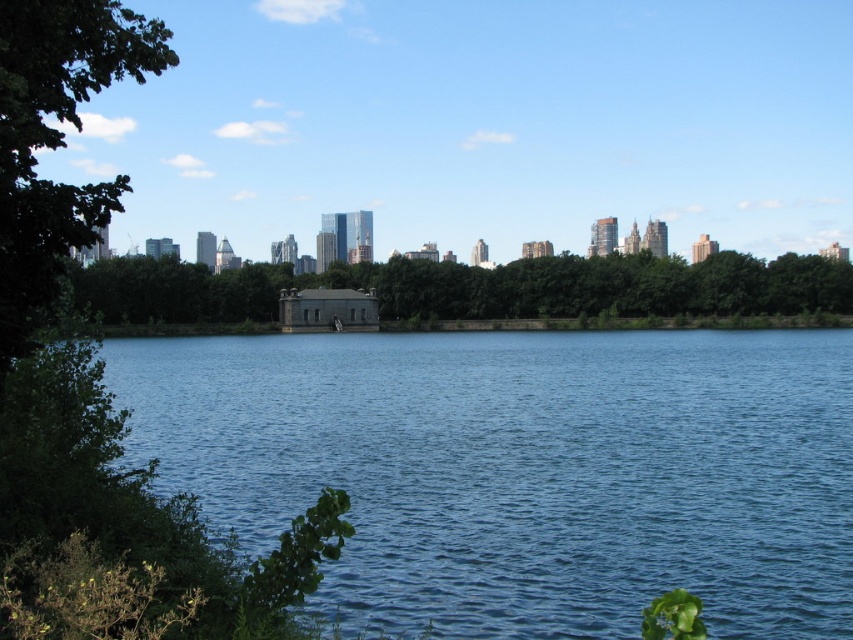
You are planning to take a photo of the blue water at center and the green leafy tree at left. Which object will appear wider in the photo?

The blue water at center will appear wider in the photo because its width is larger than the green leafy tree at left.

You are standing at the center of the image. Which direction should you walk to reach the green leafy trees at center?

The green leafy trees at center are located at point (474, 288), so you should walk towards the center of the image to reach them.

You are standing at the lakeside and want to take a photo of both the blue water at center and the green leafy trees at center. Which object should you position closer to the left side of your camera frame?

You should position the blue water at center closer to the left side of your camera frame because the blue water at center is to the left of green leafy trees at center.